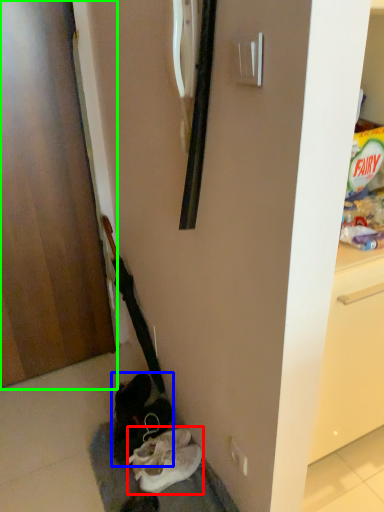
Question: Which object is positioned farthest from footwear (highlighted by a red box)? Select from footwear (highlighted by a blue box) and door (highlighted by a green box).

Choices:
 (A) footwear
 (B) door

Answer: (B)